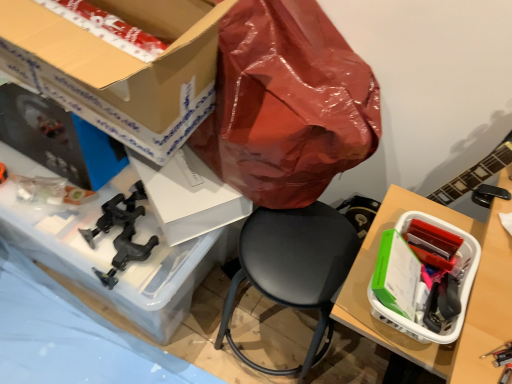
Where is `vacant area situated below white plastic basket at right, the 1th box positioned from the bottom (from a real-world perspective)`? The height and width of the screenshot is (384, 512). vacant area situated below white plastic basket at right, the 1th box positioned from the bottom (from a real-world perspective) is located at coordinates (341, 359).